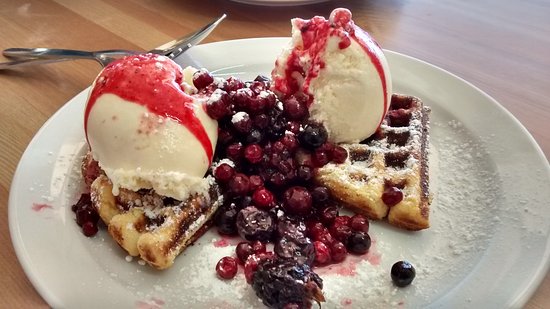
This screenshot has height=309, width=550. Identify the location of inner rim of plate. (491, 226).